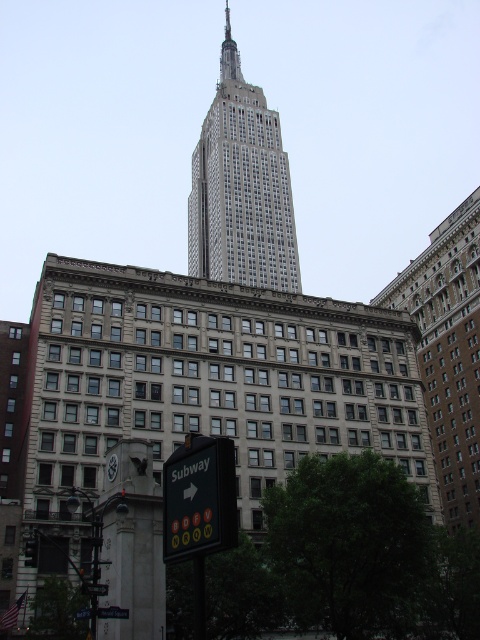
You are a tourist standing in the middle of the street looking at the Empire State Building. You see a white glass building at center and a black plastic sign at lower center. Which object is located to the left of the other?

The white glass building at center is positioned on the left side of black plastic sign at lower center.

You are a city planner analyzing the urban layout. You need to determine which object, the metallic traffic light at lower left or the green plastic street sign at lower center, requires more space for maintenance access. Based on their sizes, which one would need a larger maintenance area?

The metallic traffic light at lower left is bigger than the green plastic street sign at lower center, so it would require a larger maintenance area.